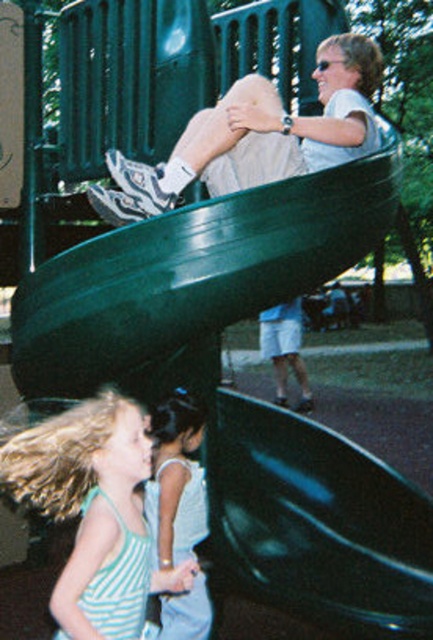
Between striped fabric dress at lower left and white satin dress at lower center, which one appears on the left side from the viewer's perspective?

striped fabric dress at lower left

Measure the distance between point (60, 444) and camera.

A distance of 3.30 meters exists between point (60, 444) and camera.

At what (x,y) coordinates should I click in order to perform the action: click on striped fabric dress at lower left. Please return your answer as a coordinate pair (x, y). This screenshot has width=433, height=640. Looking at the image, I should click on (94, 513).

Does striped fabric dress at lower left come in front of matte white sneakers at upper center?

Yes, striped fabric dress at lower left is in front of matte white sneakers at upper center.

Who is more distant from viewer, (77, 579) or (155, 211)?

Point (155, 211)

At what (x,y) coordinates should I click in order to perform the action: click on striped fabric dress at lower left. Please return your answer as a coordinate pair (x, y). The height and width of the screenshot is (640, 433). Looking at the image, I should click on (94, 513).

Is matte white sneakers at upper center wider than white satin dress at lower center?

Yes, matte white sneakers at upper center is wider than white satin dress at lower center.

Who is higher up, matte white sneakers at upper center or white satin dress at lower center?

Positioned higher is matte white sneakers at upper center.

Does point (239, 173) come in front of point (186, 472)?

That is True.

Where is `matte white sneakers at upper center`? The height and width of the screenshot is (640, 433). matte white sneakers at upper center is located at coordinates [255, 136].